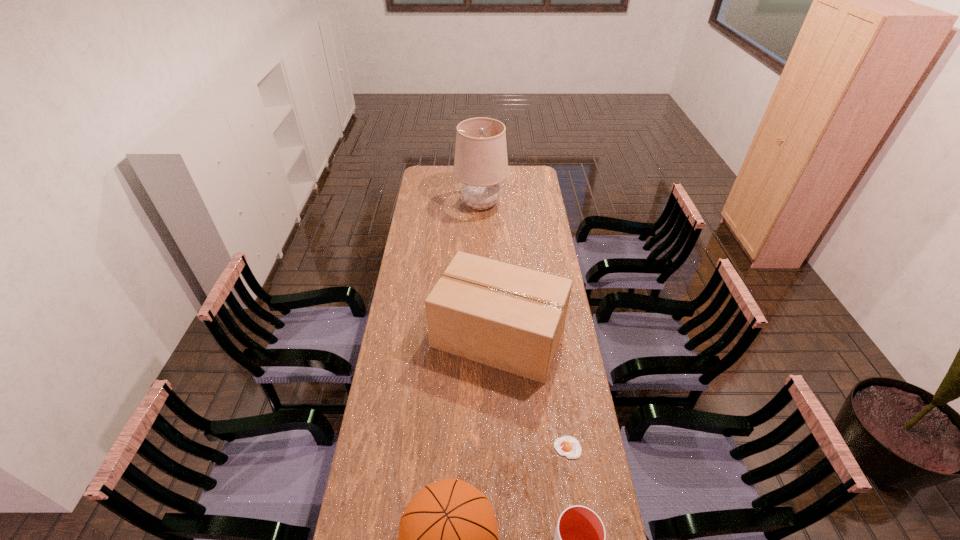
The height and width of the screenshot is (540, 960). In the image, there is a desktop. Identify the location of vacant space at the left edge. (413, 315).

In the image, there is a desktop. Where is `vacant space at the right edge`? This screenshot has height=540, width=960. vacant space at the right edge is located at coordinates (529, 268).

Locate an element on the screen. This screenshot has height=540, width=960. free space at the far left corner of the desktop is located at coordinates (421, 174).

Where is `vacant space at the far right corner of the desktop`? This screenshot has width=960, height=540. vacant space at the far right corner of the desktop is located at coordinates (516, 169).

Where is `vacant area between the second farthest object and the egg yolk`? The width and height of the screenshot is (960, 540). vacant area between the second farthest object and the egg yolk is located at coordinates (533, 392).

Select which object is the third closest to the basketball. Please provide its 2D coordinates. Your answer should be formatted as a tuple, i.e. [(x, y)], where the tuple contains the x and y coordinates of a point satisfying the conditions above.

[(508, 317)]

Point out which object is positioned as the fourth nearest to the box. Please provide its 2D coordinates. Your answer should be formatted as a tuple, i.e. [(x, y)], where the tuple contains the x and y coordinates of a point satisfying the conditions above.

[(480, 163)]